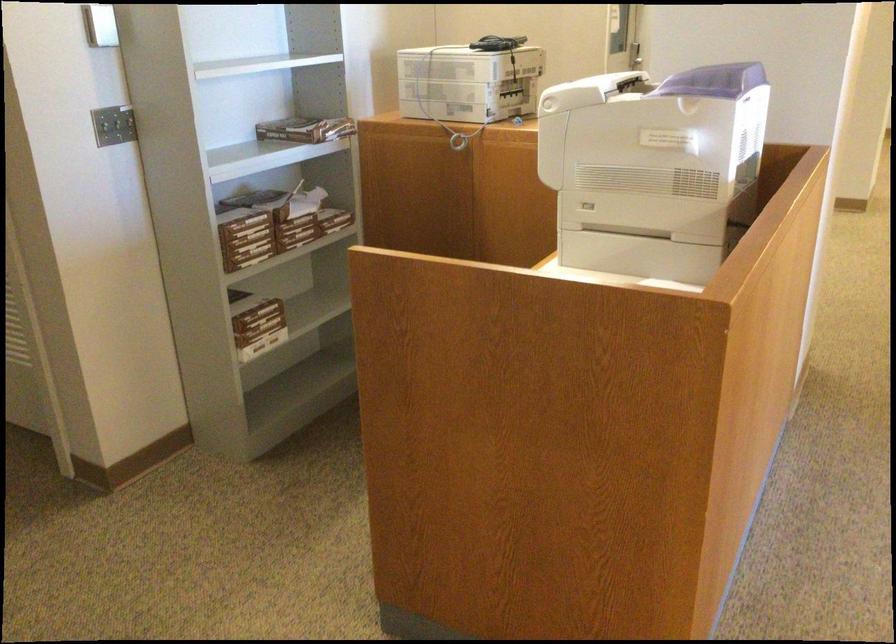
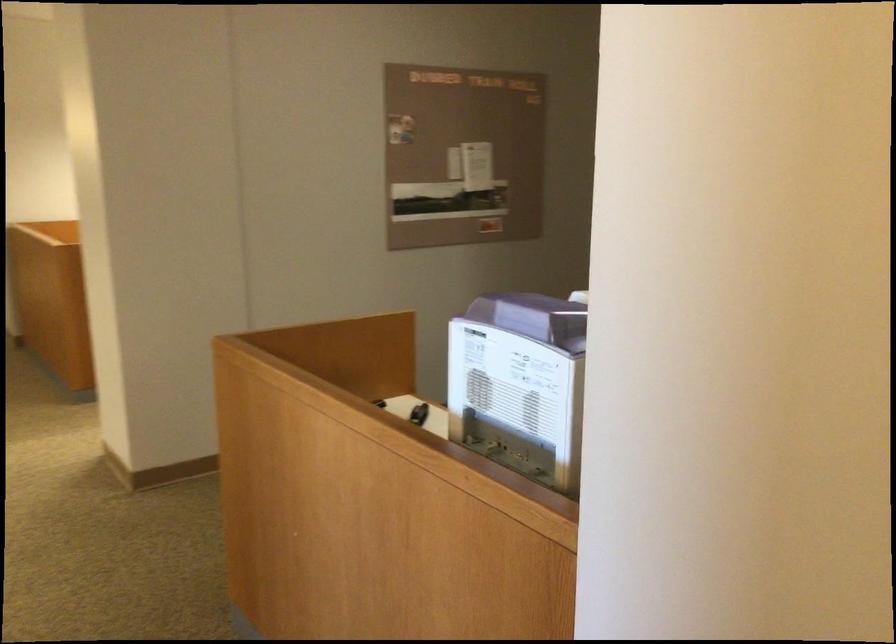
Question: I am providing you with two images of the same scene from different viewpoints. Please identify which objects are invisible in image2.

Choices:
 (A) small black object
 (B) orange control knob
 (C) ream of paper
 (D) purple machine lid

Answer: (C)